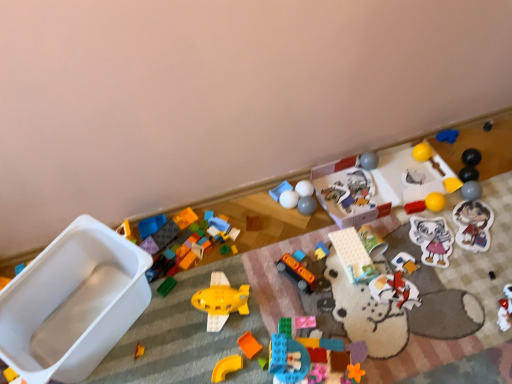
Locate an element on the screen. Image resolution: width=512 pixels, height=384 pixels. vacant space that is to the left of rubber duck at center, which ranks as the eleventh toy in right-to-left order is located at coordinates (274, 267).